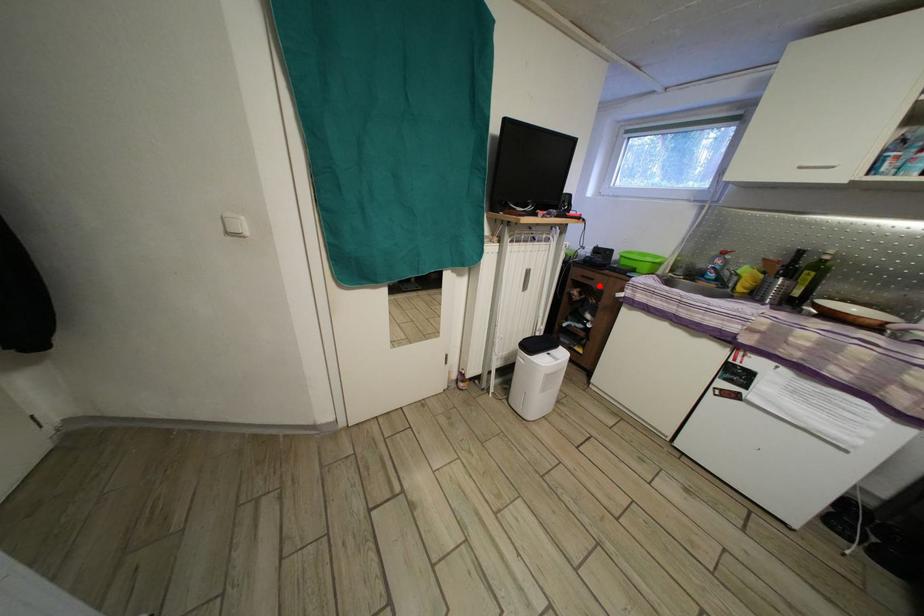
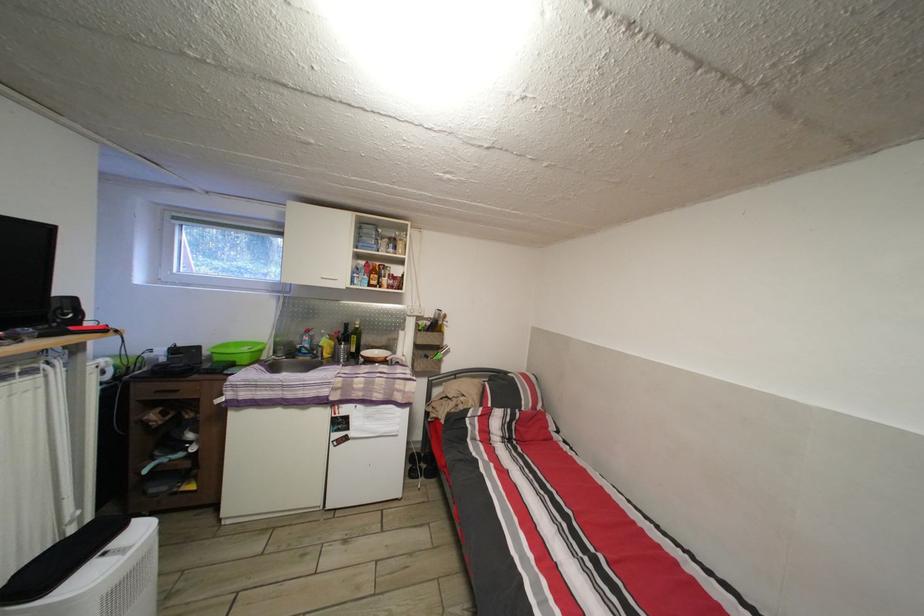
In the second image, find the point that corresponds to the highlighted location in the first image.

(184, 398)